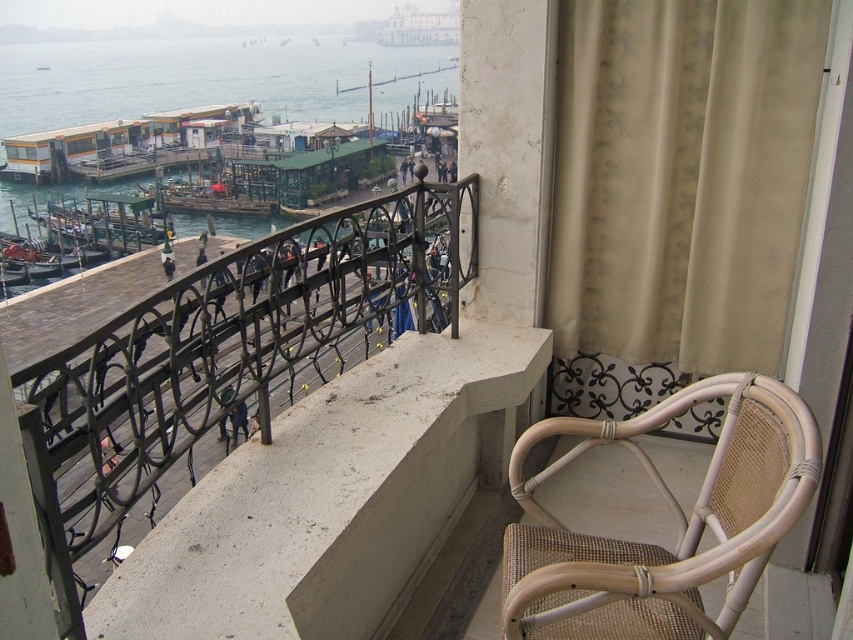
Question: Does black wrought iron railing at center have a greater width compared to green wooden dock at center?

Choices:
 (A) yes
 (B) no

Answer: (A)

Question: Which is nearer to the black wrought iron railing at center?

Choices:
 (A) beige fabric curtain at upper right
 (B) clear water at upper left
 (C) wooden gondola at left

Answer: (A)

Question: Which point is closer to the camera taking this photo?

Choices:
 (A) (437, 227)
 (B) (721, 432)
 (C) (117, 252)

Answer: (B)

Question: Is beige fabric curtain at upper right positioned before wooden gondola at left?

Choices:
 (A) no
 (B) yes

Answer: (B)

Question: Which point is farther from the camera taking this photo?

Choices:
 (A) (62, 145)
 (B) (45, 214)
 (C) (207, 92)
 (D) (779, 364)

Answer: (C)

Question: Can you confirm if light beige woven chair at lower right is thinner than green wooden dock at center?

Choices:
 (A) no
 (B) yes

Answer: (B)